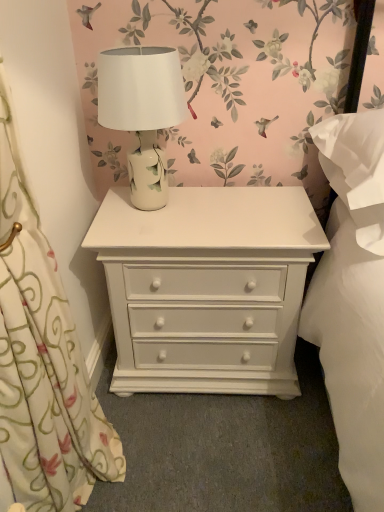
I want to click on white floral fabric at left, so click(42, 362).

The image size is (384, 512). I want to click on white painted wood chest of drawers at center, so click(207, 288).

You are a GUI agent. You are given a task and a screenshot of the screen. Output one action in this format:
    pyautogui.click(x=<x>, y=<y>)
    Task: Click on the white floral fabric at left
    The image size is (384, 512).
    Given the screenshot: What is the action you would take?
    pyautogui.click(x=42, y=362)

Considering the relative sizes of white painted wood chest of drawers at center and white ceramic table lamp at center in the image provided, is white painted wood chest of drawers at center shorter than white ceramic table lamp at center?

No, white painted wood chest of drawers at center is not shorter than white ceramic table lamp at center.

Based on their sizes in the image, would you say white painted wood chest of drawers at center is bigger or smaller than white ceramic table lamp at center?

Answer: Considering their sizes, white painted wood chest of drawers at center takes up more space than white ceramic table lamp at center.

Which is farther from the camera, (206, 247) or (154, 80)?

The point (206, 247) is behind.

Is white painted wood chest of drawers at center facing away from white ceramic table lamp at center?

That's not correct — white painted wood chest of drawers at center is not looking away from white ceramic table lamp at center.

Is white floral fabric at left thinner than white ceramic table lamp at center?

Yes.

Is white floral fabric at left located outside white ceramic table lamp at center?

Yes, white floral fabric at left is located beyond the bounds of white ceramic table lamp at center.

How far apart are white floral fabric at left and white ceramic table lamp at center?

white floral fabric at left and white ceramic table lamp at center are 19.88 inches apart.

From a real-world perspective, between white floral fabric at left and white ceramic table lamp at center, who is vertically higher?

In real-world perspective, white ceramic table lamp at center is above.

In terms of width, does white ceramic table lamp at center look wider or thinner when compared to white floral fabric at left?

In the image, white ceramic table lamp at center appears to be wider than white floral fabric at left.

Is white ceramic table lamp at center not near white floral fabric at left?

No, there isn't a large distance between white ceramic table lamp at center and white floral fabric at left.

Which is behind, point (153, 186) or point (26, 429)?

The point (153, 186) is farther.

Between white ceramic table lamp at center and white floral fabric at left, which one has more height?

white floral fabric at left.

From a real-world perspective, is white floral fabric at left physically below white painted wood chest of drawers at center?

No, from a real-world perspective, white floral fabric at left is not beneath white painted wood chest of drawers at center.

Does white floral fabric at left have a smaller size compared to white painted wood chest of drawers at center?

Yes.

Between white floral fabric at left and white painted wood chest of drawers at center, which one appears on the left side from the viewer's perspective?

Positioned to the left is white floral fabric at left.

Choose the correct answer: Is white ceramic table lamp at center inside white painted wood chest of drawers at center or outside it?

white ceramic table lamp at center exists outside the volume of white painted wood chest of drawers at center.

Can you see white ceramic table lamp at center touching white painted wood chest of drawers at center?

No, white ceramic table lamp at center is not making contact with white painted wood chest of drawers at center.

Find the location of a particular element. chest of drawers on the right of white ceramic table lamp at center is located at coordinates (207, 288).

How many degrees apart are the facing directions of white ceramic table lamp at center and white painted wood chest of drawers at center?

The angle between the facing direction of white ceramic table lamp at center and the facing direction of white painted wood chest of drawers at center is 1.82 degrees.

Can you confirm if white painted wood chest of drawers at center is bigger than white floral fabric at left?

Yes, white painted wood chest of drawers at center is bigger than white floral fabric at left.

From a real-world perspective, is white painted wood chest of drawers at center located higher than white floral fabric at left?

Incorrect, from a real-world perspective, white painted wood chest of drawers at center is lower than white floral fabric at left.

Is white painted wood chest of drawers at center facing towards white floral fabric at left?

Yes, white painted wood chest of drawers at center is oriented towards white floral fabric at left.

At what (x,y) coordinates should I click in order to perform the action: click on table lamp in front of the white painted wood chest of drawers at center. Please return your answer as a coordinate pair (x, y). Looking at the image, I should click on [142, 112].

This screenshot has width=384, height=512. Identify the location of table lamp on the right of white floral fabric at left. (142, 112).

Considering their positions, is white painted wood chest of drawers at center positioned closer to white ceramic table lamp at center than white floral fabric at left?

white painted wood chest of drawers at center.

Which object lies further to the anchor point white painted wood chest of drawers at center, white floral fabric at left or white ceramic table lamp at center?

Based on the image, white floral fabric at left appears to be further to white painted wood chest of drawers at center.

Based on their spatial positions, is white floral fabric at left or white painted wood chest of drawers at center further from white ceramic table lamp at center?

white floral fabric at left is positioned further to the anchor white ceramic table lamp at center.

Based on their spatial positions, is white ceramic table lamp at center or white floral fabric at left closer to white painted wood chest of drawers at center?

The object closer to white painted wood chest of drawers at center is white ceramic table lamp at center.

Looking at the image, which one is located closer to white floral fabric at left, white painted wood chest of drawers at center or white ceramic table lamp at center?

Based on the image, white painted wood chest of drawers at center appears to be nearer to white floral fabric at left.

Which object lies nearer to the anchor point white floral fabric at left, white ceramic table lamp at center or white painted wood chest of drawers at center?

Based on the image, white painted wood chest of drawers at center appears to be nearer to white floral fabric at left.

What are the coordinates of `table lamp located between white floral fabric at left and white painted wood chest of drawers at center in the depth direction` in the screenshot? It's located at (142, 112).